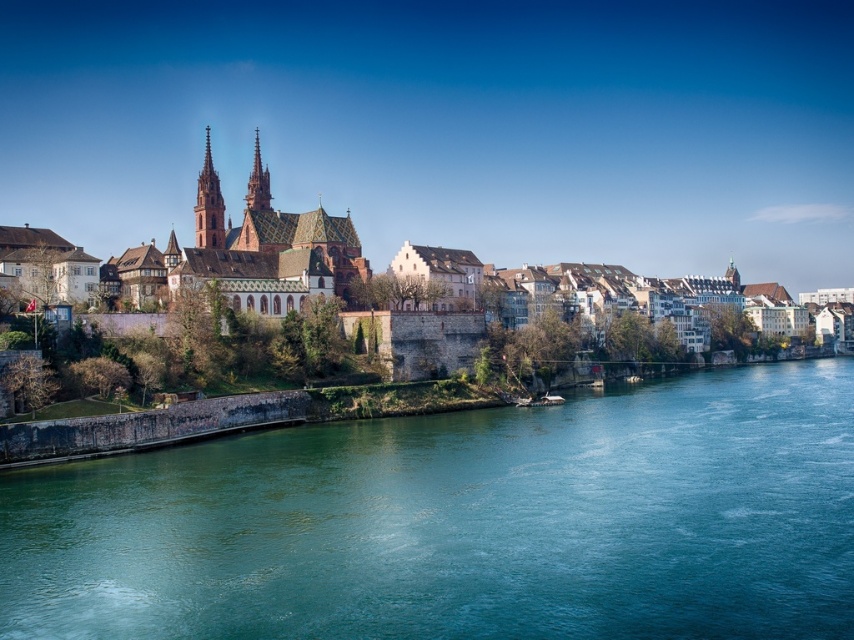
Question: Which object is farther from the camera taking this photo?

Choices:
 (A) reddish-brown stone spire at center
 (B) greenish-blue water at lower left

Answer: (A)

Question: Can you confirm if brown stone town at center is bigger than reddish-brown stone spire at center?

Choices:
 (A) no
 (B) yes

Answer: (B)

Question: Does greenish-blue water at lower left appear on the left side of brown stone town at center?

Choices:
 (A) no
 (B) yes

Answer: (A)

Question: Which object is the farthest from the brown stone town at center?

Choices:
 (A) greenish-blue water at lower left
 (B) reddish-brown stone spire at center
 (C) smooth stone spire at center

Answer: (A)

Question: Is greenish-blue water at lower left to the left of smooth stone spire at center from the viewer's perspective?

Choices:
 (A) no
 (B) yes

Answer: (A)

Question: Which point is farther to the camera?

Choices:
 (A) (217, 250)
 (B) (264, 173)
 (C) (202, 216)
 (D) (671, 621)

Answer: (B)